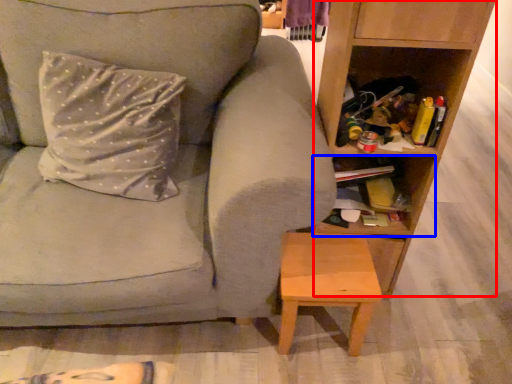
Question: Among these objects, which one is farthest to the camera, shelf (highlighted by a red box) or cabinet (highlighted by a blue box)?

Choices:
 (A) shelf
 (B) cabinet

Answer: (B)